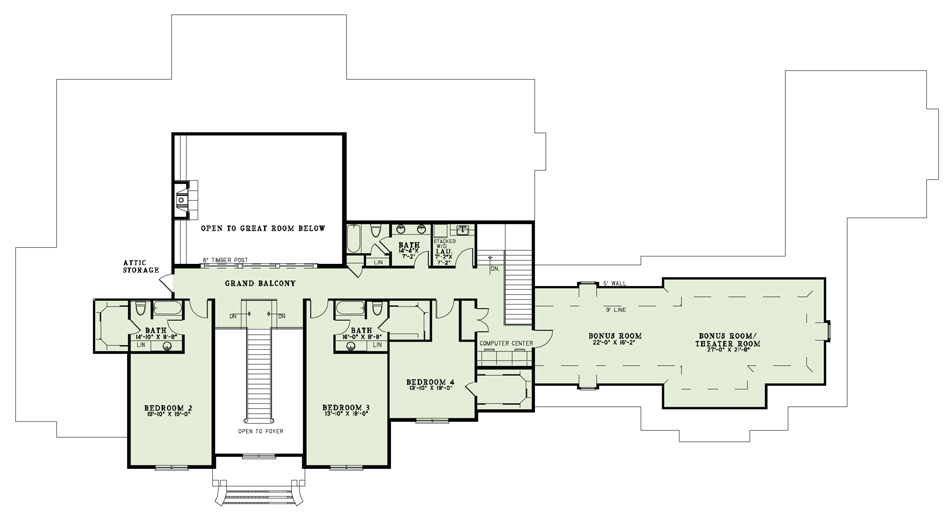
Where is `room you sleep in`? room you sleep in is located at coordinates (359, 423), (464, 381), (162, 414).